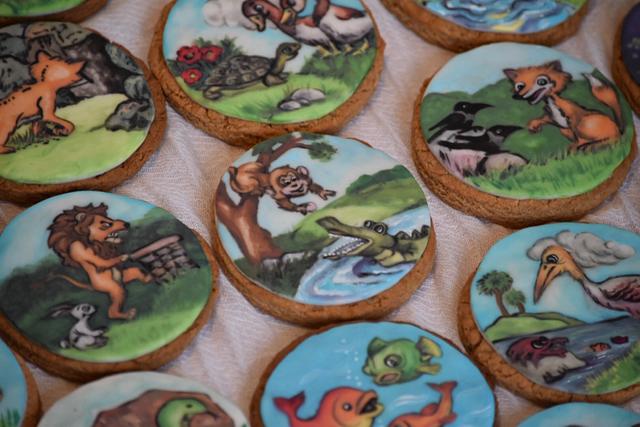
Locate an element on the screen. This screenshot has height=427, width=640. cork coaster bases is located at coordinates (143, 161), (198, 126), (432, 26), (451, 194), (417, 289), (195, 330), (481, 362).